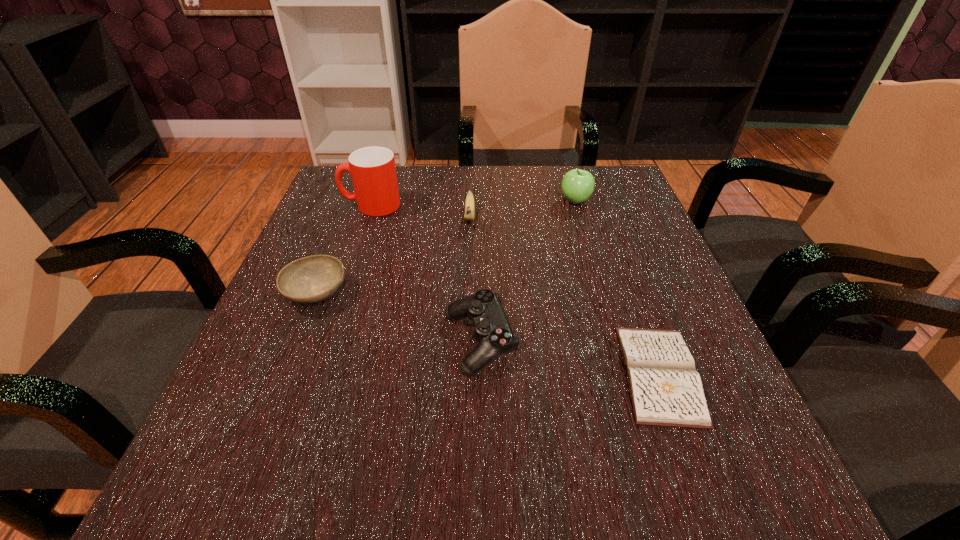
I want to click on vacant space that is in between the second shortest object and the tallest object, so click(344, 249).

Where is `unoccupied position between the control and the bowl`? This screenshot has width=960, height=540. unoccupied position between the control and the bowl is located at coordinates (398, 318).

Find the location of a particular element. free space between the diary and the banana is located at coordinates (564, 296).

Locate an element on the screen. The width and height of the screenshot is (960, 540). free space between the diary and the cup is located at coordinates (516, 290).

At what (x,y) coordinates should I click in order to perform the action: click on object that is the third nearest to the tallest object. Please return your answer as a coordinate pair (x, y). Looking at the image, I should click on (492, 329).

The image size is (960, 540). What are the coordinates of `object that stands as the fourth closest to the fifth tallest object` in the screenshot? It's located at (666, 390).

Identify the location of vacant area in the image that satisfies the following two spatial constraints: 1. on the side of the tallest object with the handle; 2. on the back side of the second tallest object. Image resolution: width=960 pixels, height=540 pixels. (372, 201).

The height and width of the screenshot is (540, 960). Find the location of `vacant region that satisfies the following two spatial constraints: 1. at the stem of the shortest object; 2. on the right side of the banana`. vacant region that satisfies the following two spatial constraints: 1. at the stem of the shortest object; 2. on the right side of the banana is located at coordinates (465, 374).

What are the coordinates of `vacant region that satisfies the following two spatial constraints: 1. at the stem of the banana; 2. on the right side of the shortest object` in the screenshot? It's located at (465, 374).

Locate an element on the screen. vacant region that satisfies the following two spatial constraints: 1. on the side of the apple with the handle; 2. on the left side of the cup is located at coordinates (372, 201).